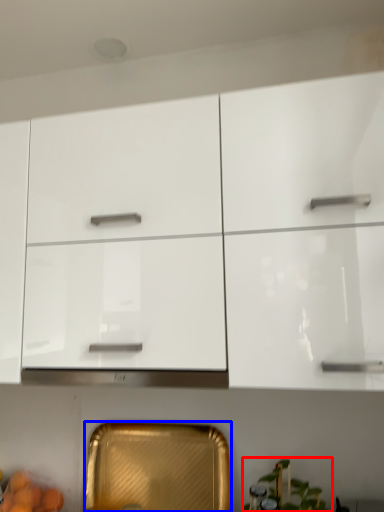
Question: Which point is closer to the camera, plant (highlighted by a red box) or cabinetry (highlighted by a blue box)?

Choices:
 (A) plant
 (B) cabinetry

Answer: (A)